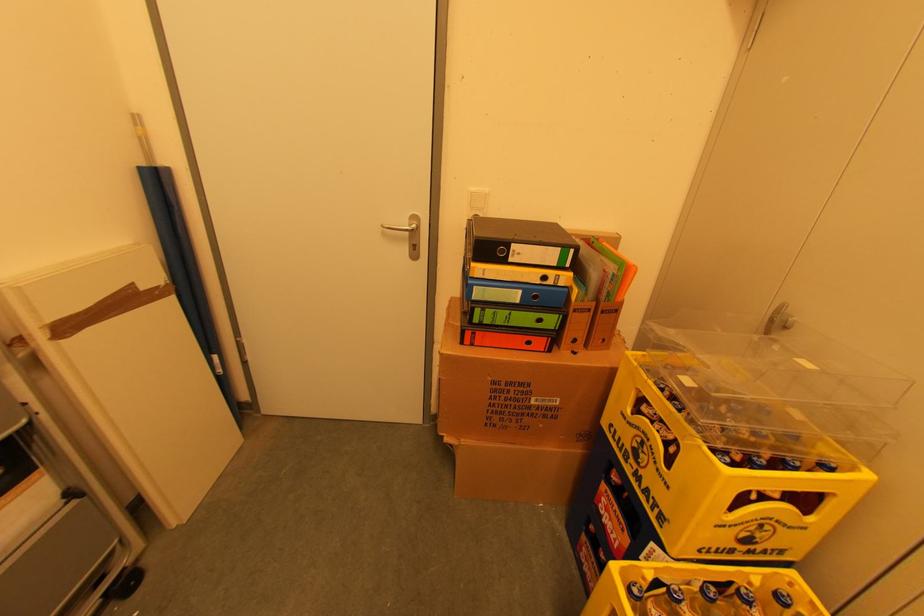
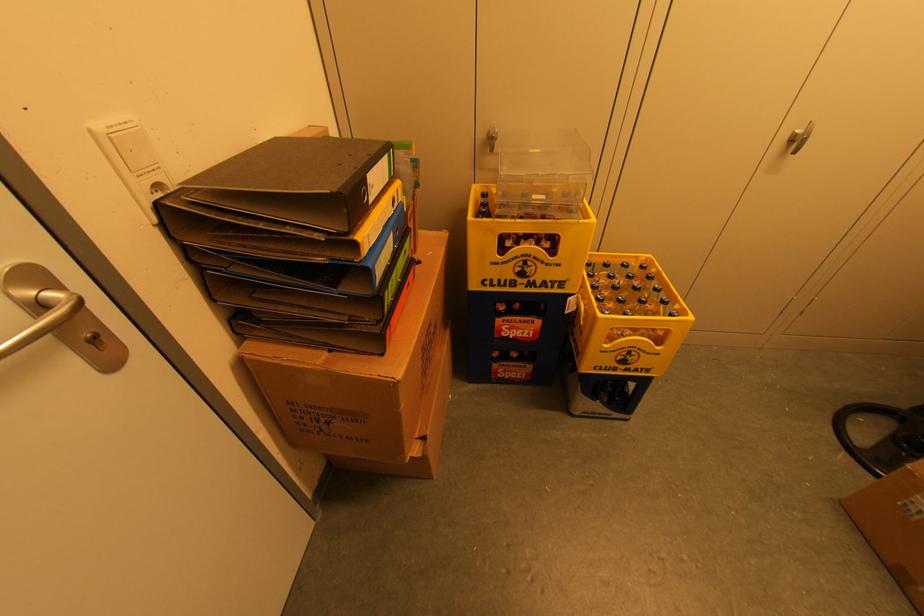
Locate, in the second image, the point that corresponds to (x=517, y=252) in the first image.

(371, 185)